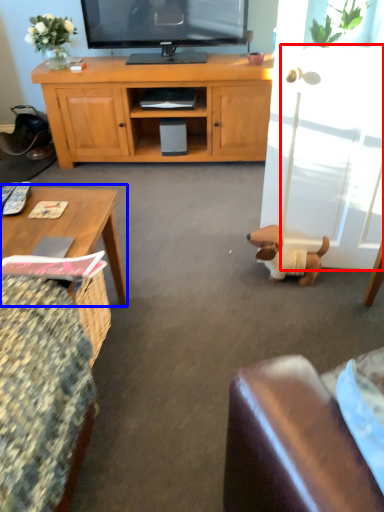
Question: Which point is closer to the camera, glass door (highlighted by a red box) or coffee table (highlighted by a blue box)?

Choices:
 (A) glass door
 (B) coffee table

Answer: (B)